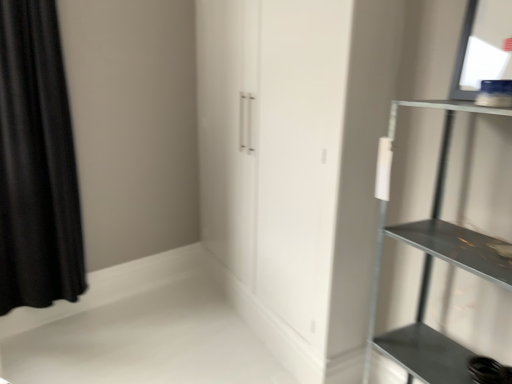
Question: From the image's perspective, is metallic gray shelf at right located beneath black velvet curtain at left?

Choices:
 (A) no
 (B) yes

Answer: (B)

Question: Does metallic gray shelf at right lie behind black velvet curtain at left?

Choices:
 (A) no
 (B) yes

Answer: (A)

Question: Does metallic gray shelf at right have a larger size compared to black velvet curtain at left?

Choices:
 (A) yes
 (B) no

Answer: (A)

Question: Considering the relative sizes of metallic gray shelf at right and black velvet curtain at left in the image provided, is metallic gray shelf at right taller than black velvet curtain at left?

Choices:
 (A) no
 (B) yes

Answer: (A)

Question: Is there a large distance between metallic gray shelf at right and black velvet curtain at left?

Choices:
 (A) yes
 (B) no

Answer: (A)

Question: Could you tell me if metallic gray shelf at right is turned towards black velvet curtain at left?

Choices:
 (A) yes
 (B) no

Answer: (B)

Question: Considering the relative sizes of black velvet curtain at left and metallic gray shelf at right in the image provided, is black velvet curtain at left taller than metallic gray shelf at right?

Choices:
 (A) yes
 (B) no

Answer: (A)

Question: Is black velvet curtain at left to the left of metallic gray shelf at right from the viewer's perspective?

Choices:
 (A) yes
 (B) no

Answer: (A)

Question: Is black velvet curtain at left bigger than metallic gray shelf at right?

Choices:
 (A) no
 (B) yes

Answer: (A)

Question: Is metallic gray shelf at right inside black velvet curtain at left?

Choices:
 (A) no
 (B) yes

Answer: (A)

Question: Is black velvet curtain at left facing away from metallic gray shelf at right?

Choices:
 (A) yes
 (B) no

Answer: (B)

Question: Is black velvet curtain at left shorter than metallic gray shelf at right?

Choices:
 (A) no
 (B) yes

Answer: (A)

Question: Considering their positions, is metallic gray shelf at right located in front of or behind black velvet curtain at left?

Choices:
 (A) front
 (B) behind

Answer: (A)